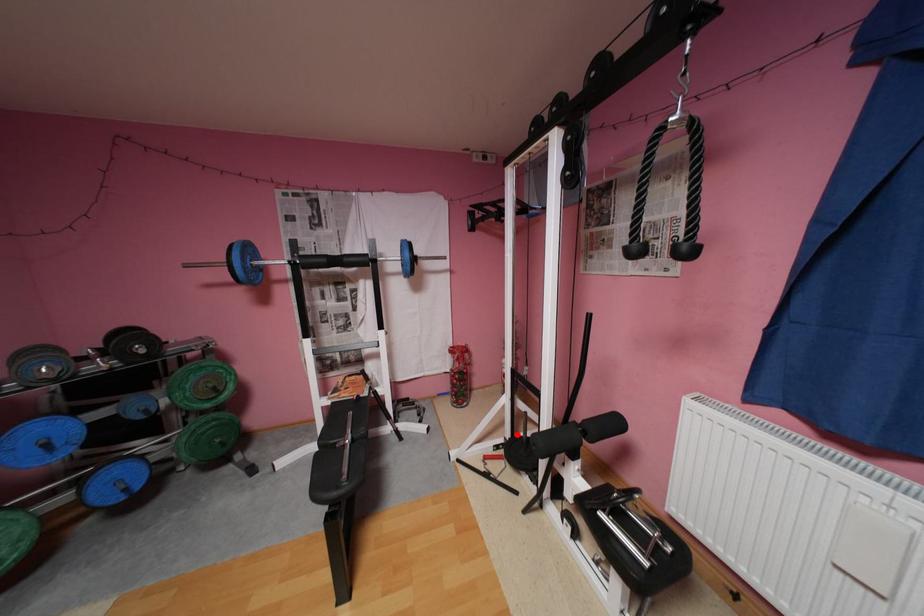
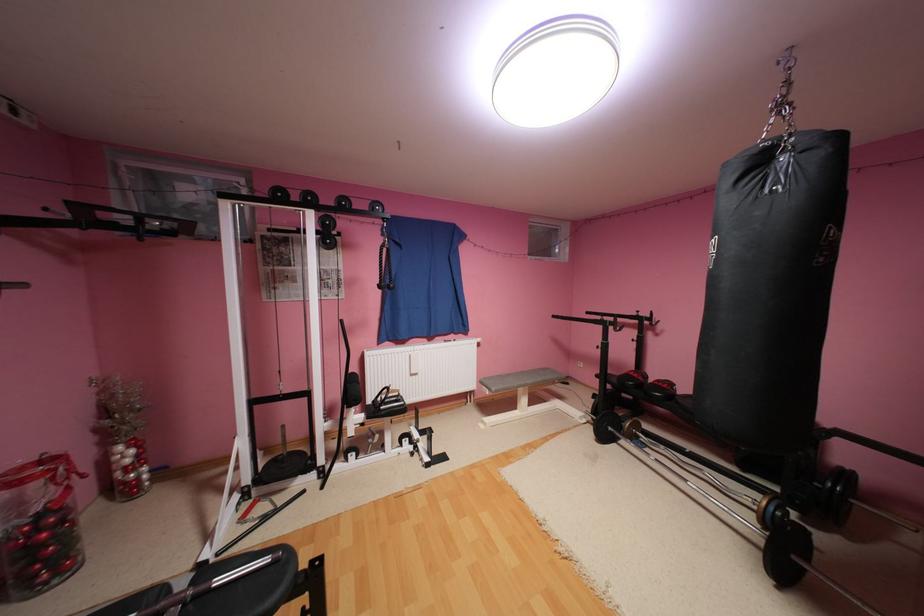
Question: I am providing you with two images of the same scene from different viewpoints. In image1, a red point is highlighted. Considering the same 3D point in image2, which of the following is correct?

Choices:
 (A) It is closer
 (B) It is farther

Answer: (A)